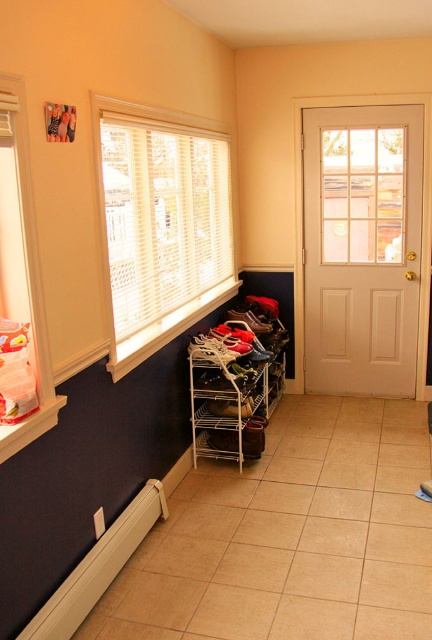
Question: Among these points, which one is farthest from the camera?

Choices:
 (A) (251, 310)
 (B) (391, 157)

Answer: (A)

Question: Among these objects, which one is farthest from the camera?

Choices:
 (A) white blinds at upper left
 (B) white matte door at right
 (C) white metal shoe rack at center

Answer: (B)

Question: Is white blinds at upper left bigger than white metal shoe rack at center?

Choices:
 (A) yes
 (B) no

Answer: (A)

Question: Does white matte door at right appear on the left side of white blinds at upper left?

Choices:
 (A) no
 (B) yes

Answer: (A)

Question: Which object appears farthest from the camera in this image?

Choices:
 (A) white matte door at right
 (B) white metal shoe rack at center
 (C) white plastic baseboard at lower left
 (D) white blinds at upper left

Answer: (A)

Question: Is white matte door at right positioned at the back of white metal shoe rack at center?

Choices:
 (A) no
 (B) yes

Answer: (B)